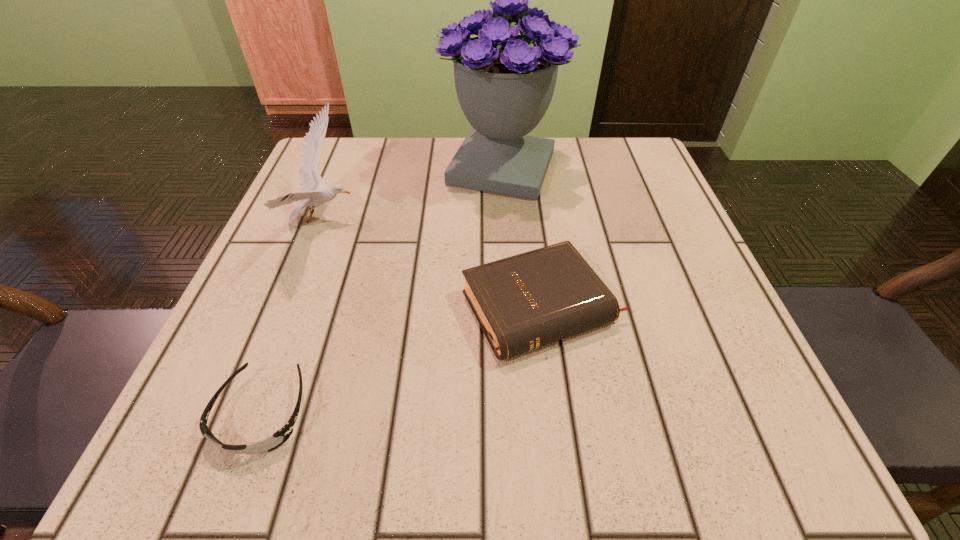
I want to click on the tallest object, so click(504, 82).

Find the location of `gull`. gull is located at coordinates (315, 192).

Where is `Bible`? Image resolution: width=960 pixels, height=540 pixels. Bible is located at coordinates (526, 301).

Locate an element on the screen. the nearest object is located at coordinates click(279, 437).

The width and height of the screenshot is (960, 540). Identify the location of sunglasses. (279, 437).

Locate an element on the screen. This screenshot has height=540, width=960. vacant space located 0.140m on the front of the tallest object is located at coordinates (508, 251).

The width and height of the screenshot is (960, 540). Identify the location of free space located at the tip of the beak of the gull. (545, 220).

Find the location of `free spot located on the front of the third tallest object`. free spot located on the front of the third tallest object is located at coordinates (558, 429).

Image resolution: width=960 pixels, height=540 pixels. I want to click on bouquet positioned at the far edge, so click(504, 82).

Locate an element on the screen. gull that is at the far edge is located at coordinates (315, 192).